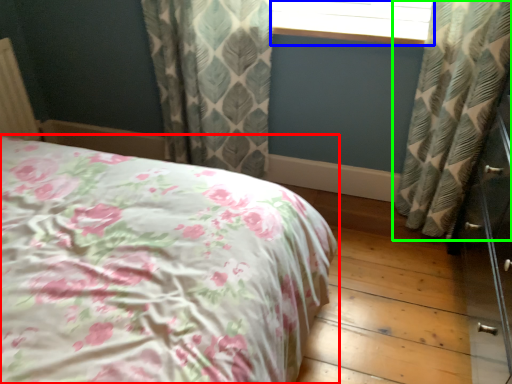
Question: Which is nearer to the bed (highlighted by a red box)? window frame (highlighted by a blue box) or curtain (highlighted by a green box).

Choices:
 (A) window frame
 (B) curtain

Answer: (B)